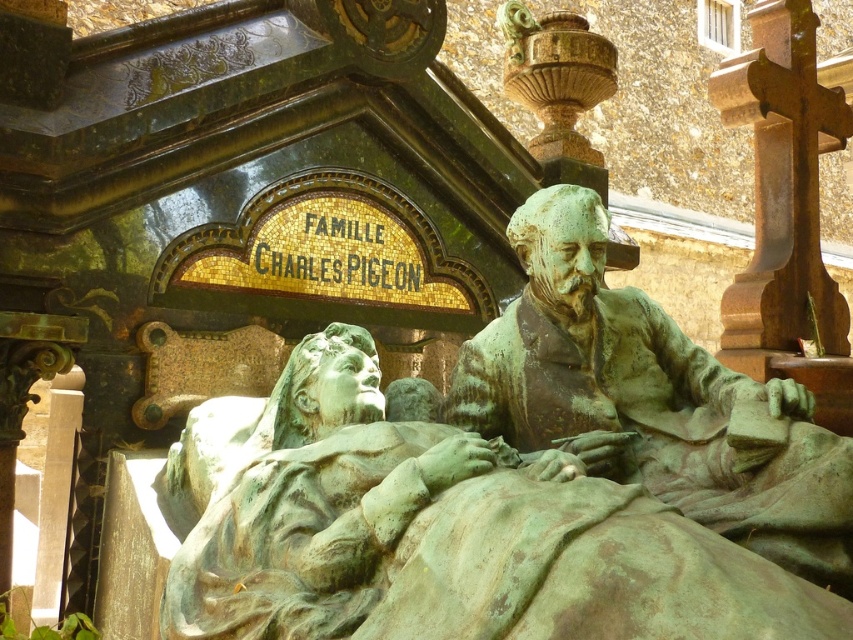
Is green patina statue at center below green patinated bronze statue at center?

Yes.

Does green patina statue at center appear on the right side of green patinated bronze statue at center?

In fact, green patina statue at center is to the left of green patinated bronze statue at center.

You are a GUI agent. You are given a task and a screenshot of the screen. Output one action in this format:
    pyautogui.click(x=<x>, y=<y>)
    Task: Click on the green patina statue at center
    The height and width of the screenshot is (640, 853).
    Given the screenshot: What is the action you would take?
    pyautogui.click(x=450, y=536)